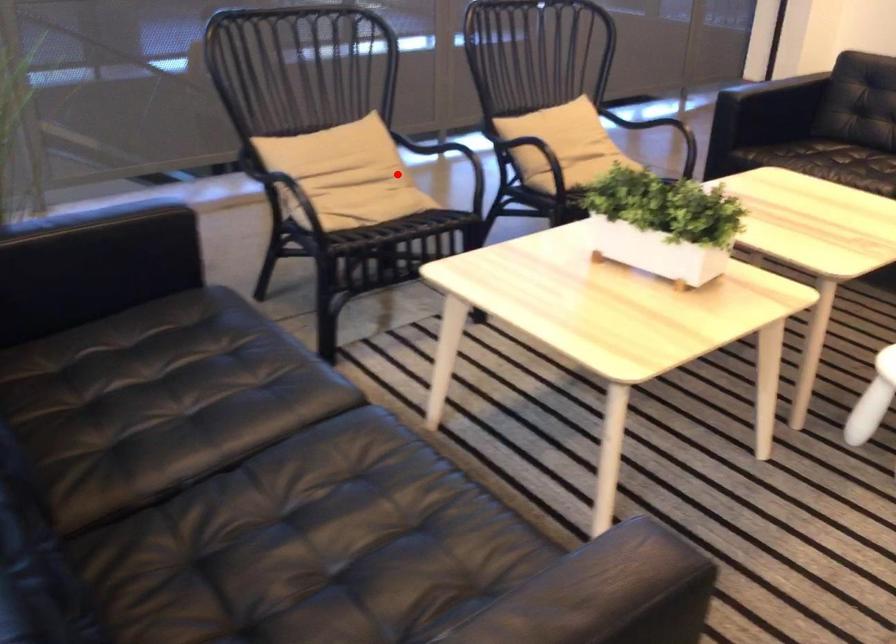
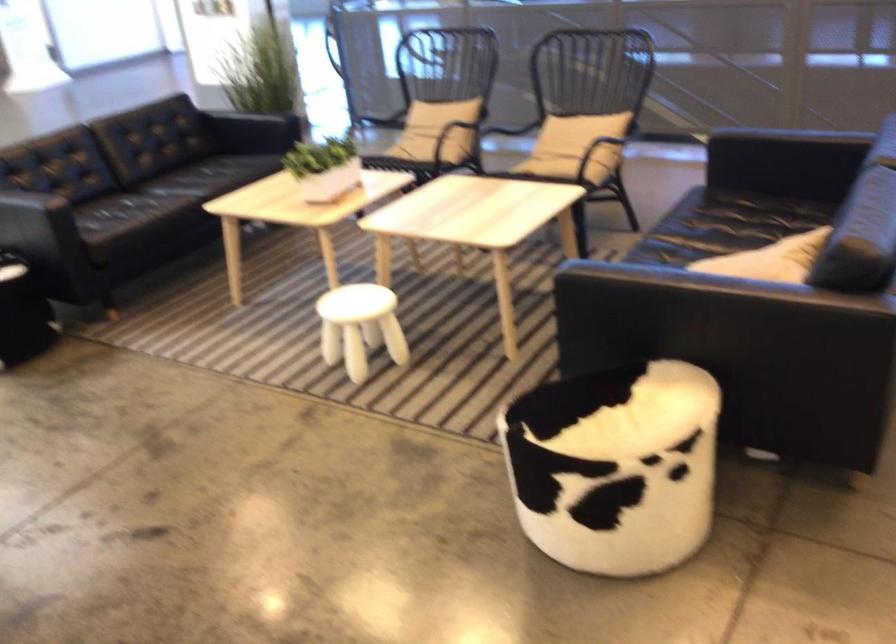
Question: I am providing you with two images of the same scene from different viewpoints. Image1 has a red point marked. In image2, the corresponding 3D location appears at what relative position? Reply with the corresponding letter.

Choices:
 (A) Closer
 (B) Farther

Answer: (B)